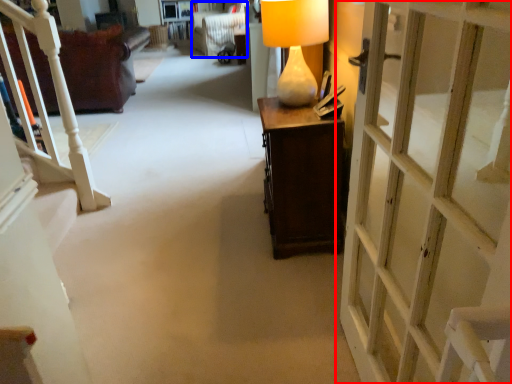
Question: Which of the following is the closest to the observer, door (highlighted by a red box) or armchair (highlighted by a blue box)?

Choices:
 (A) door
 (B) armchair

Answer: (A)